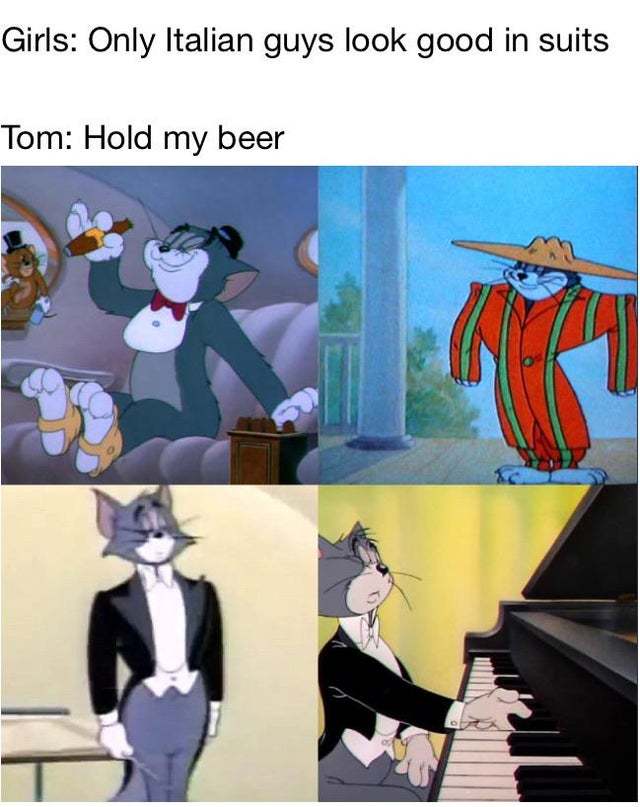
The image size is (640, 807). I want to click on white piano keys, so click(x=486, y=755), click(x=477, y=771).